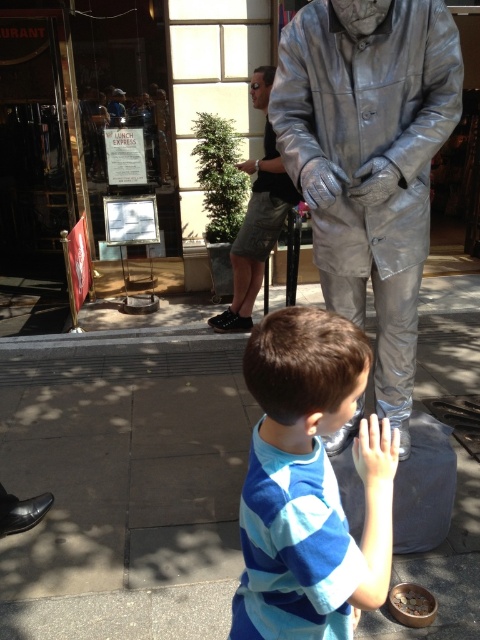
You are a painter standing at the corner of the street. You want to paint both the shiny metallic suit at center and the matte silver hand at lower center. Which object should you focus on first if you want to paint the taller one first?

The shiny metallic suit at center is much taller than the matte silver hand at lower center, so you should focus on painting the shiny metallic suit at center first.

You are a photographer standing at the camera position. You want to take a closeup shot of the shiny metallic suit at center without moving the camera. Can you zoom in enough to capture the suit clearly?

The shiny metallic suit at center is 4.78 feet away from camera. Since the distance is relatively short, zooming in should allow you to capture the suit clearly without needing to move the camera.

You are a photographer standing at the center of the street scene. You want to take a photo that includes both the boy and the statue. The boy is at point (x=386, y=138) and the statue is at point (x=364, y=460). Which one is closer to your camera so that you can focus on it first?

Point (x=386, y=138) is further to the camera than point (x=364, y=460), so the boy at point (x=386, y=138) is closer to the camera and should be focused on first.